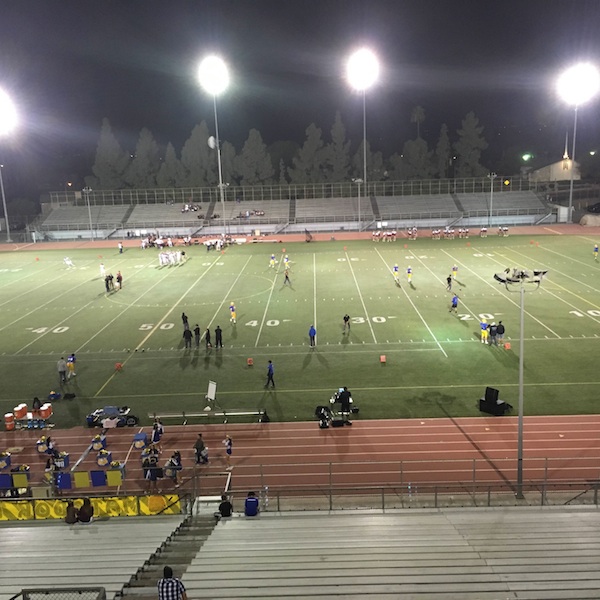
Locate an element on the screen. The width and height of the screenshot is (600, 600). stairs is located at coordinates (192, 522), (150, 579), (176, 555).